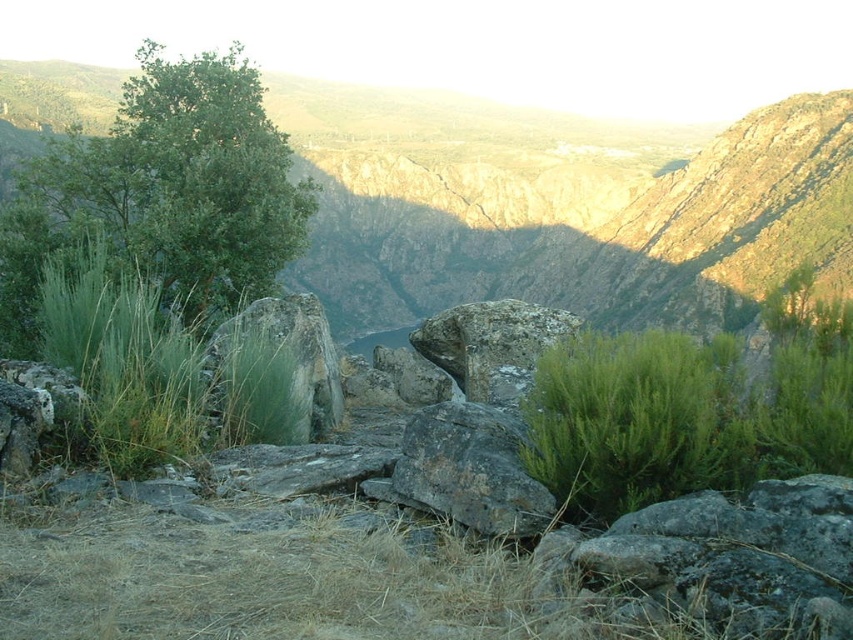
In the scene shown: Can you confirm if rusty rock at center is smaller than green rough rock at left?

Yes.

Between point (500, 422) and point (328, 396), which one is positioned behind?

The point (328, 396) is more distant.

This screenshot has width=853, height=640. I want to click on rusty rock at center, so (x=471, y=468).

You are a GUI agent. You are given a task and a screenshot of the screen. Output one action in this format:
    pyautogui.click(x=<x>, y=<y>)
    Task: Click on the rusty rock at center
    Image resolution: width=853 pixels, height=640 pixels.
    Given the screenshot: What is the action you would take?
    pyautogui.click(x=471, y=468)

Which is below, rocky cliff at center or green rough rock at left?

Positioned lower is green rough rock at left.

Is rocky cliff at center to the right of green rough rock at left from the viewer's perspective?

Yes, rocky cliff at center is to the right of green rough rock at left.

Measure the distance between rocky cliff at center and camera.

The distance of rocky cliff at center from camera is 45.08 feet.

Identify the location of rocky cliff at center. The height and width of the screenshot is (640, 853). (560, 205).

Does green leafy tree at upper left appear under rough textured rock at center?

No, green leafy tree at upper left is not below rough textured rock at center.

At what (x,y) coordinates should I click in order to perform the action: click on green leafy tree at upper left. Please return your answer as a coordinate pair (x, y). This screenshot has height=640, width=853. Looking at the image, I should click on (167, 188).

Locate an element on the screen. green leafy tree at upper left is located at coordinates [x=167, y=188].